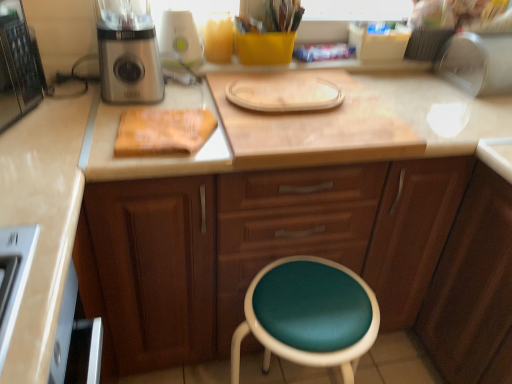
I want to click on vacant space to the right of satin silver blender at left, so click(x=186, y=96).